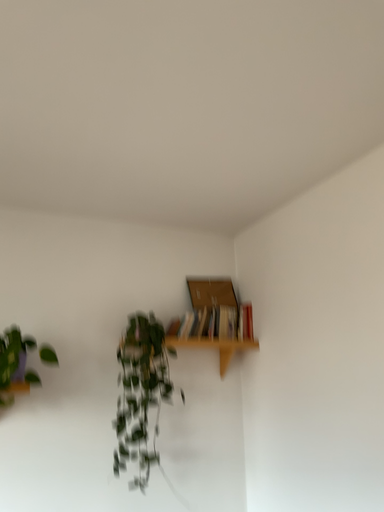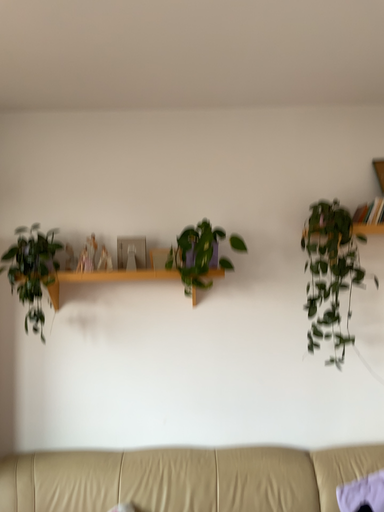
Question: Which way did the camera rotate in the video?

Choices:
 (A) rotated right
 (B) rotated left

Answer: (B)